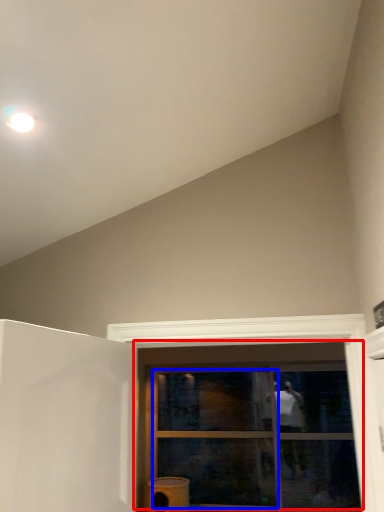
Question: Which object appears farthest to the camera in this image, window (highlighted by a red box) or glass door (highlighted by a blue box)?

Choices:
 (A) window
 (B) glass door

Answer: (B)